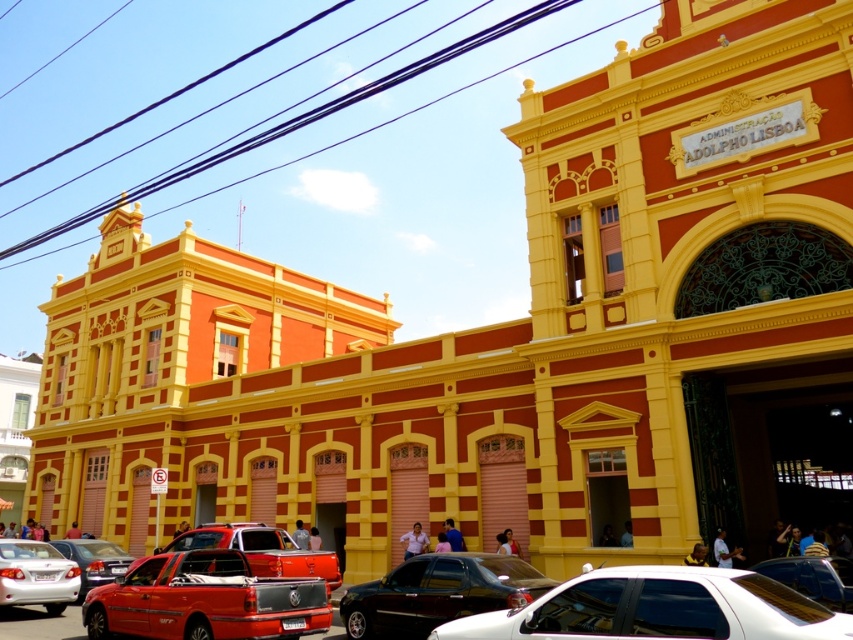
Which is above, white matte sedan at lower left or metallic silver car at lower left?

white matte sedan at lower left is higher up.

Is white matte sedan at lower left to the left of metallic silver car at lower left from the viewer's perspective?

In fact, white matte sedan at lower left is to the right of metallic silver car at lower left.

The width and height of the screenshot is (853, 640). What are the coordinates of `white matte sedan at lower left` in the screenshot? It's located at (36, 576).

Does shiny black sedan at center appear on the right side of white matte sedan at lower left?

Yes, shiny black sedan at center is to the right of white matte sedan at lower left.

Identify the location of shiny black sedan at center. The width and height of the screenshot is (853, 640). (437, 593).

Who is more forward, [367,636] or [7,579]?

Point [367,636] is in front.

Image resolution: width=853 pixels, height=640 pixels. What are the coordinates of `shiny black sedan at center` in the screenshot? It's located at [x=437, y=593].

Does shiny black sedan at center have a lesser height compared to metallic red pickup truck at center?

Incorrect, shiny black sedan at center's height does not fall short of metallic red pickup truck at center's.

Find the location of a particular element. This screenshot has width=853, height=640. shiny black sedan at center is located at coordinates (437, 593).

Identify the location of shiny black sedan at center. (437, 593).